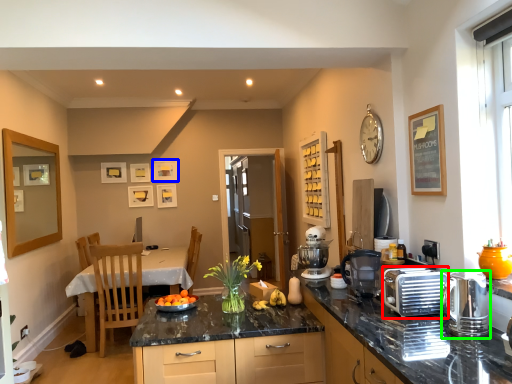
Question: Which is nearer to the appliance (highlighted by a red box)? picture frame (highlighted by a blue box) or kitchen appliance (highlighted by a green box).

Choices:
 (A) picture frame
 (B) kitchen appliance

Answer: (B)